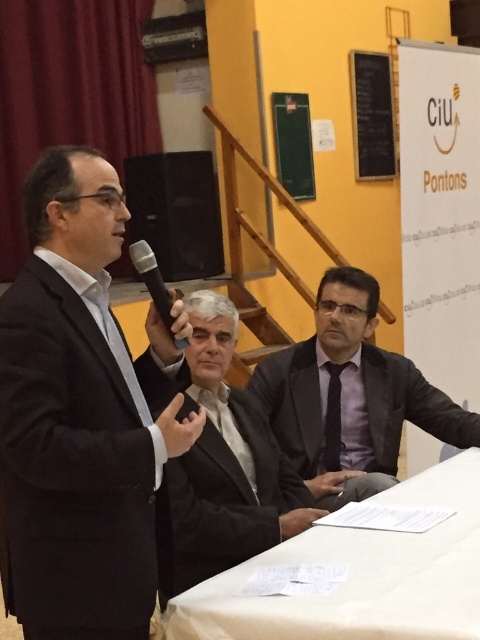
You are an event planner setting up a conference room. You need to position a projector screen where it can display content from the black matte speaker at upper center onto the black chalkboard at upper right. Is this possible given their positions?

The black matte speaker at upper center is located below the black chalkboard at upper right, so positioning a projector screen to display content from the speaker onto the chalkboard would not be feasible as the speaker is positioned lower than the chalkboard.